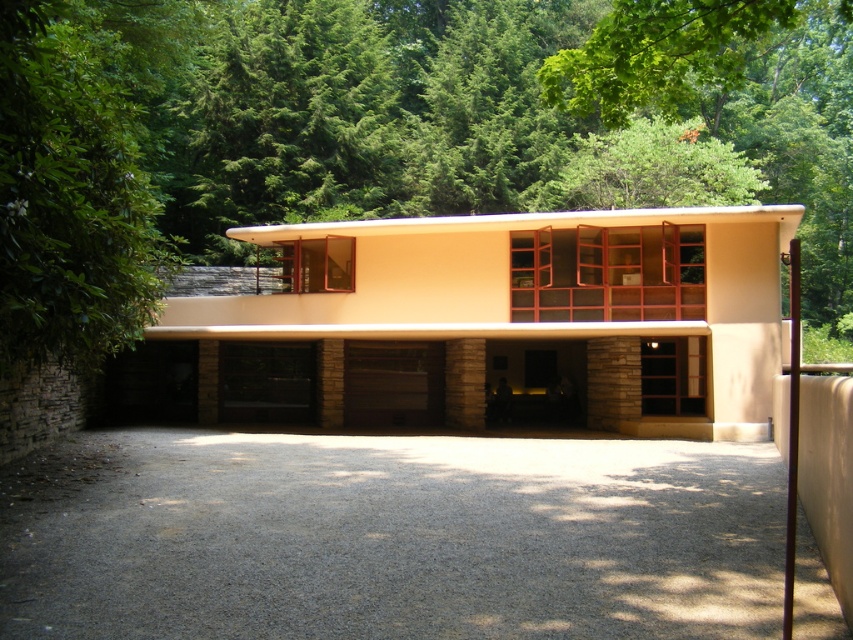
How distant is green leafy tree at upper center from gray gravel driveway at lower center?

green leafy tree at upper center and gray gravel driveway at lower center are 14.54 meters apart from each other.

Is point (643, 88) positioned before point (483, 627)?

No, (643, 88) is further to viewer.

Identify the location of green leafy tree at upper center. (373, 131).

Find the location of a particular element. Image resolution: width=853 pixels, height=640 pixels. gray gravel driveway at lower center is located at coordinates (389, 536).

Which of these two, gray gravel driveway at lower center or brown stone/glass garage door at center, stands taller?

With more height is brown stone/glass garage door at center.

What do you see at coordinates (389, 536) in the screenshot? I see `gray gravel driveway at lower center` at bounding box center [389, 536].

The height and width of the screenshot is (640, 853). Identify the location of gray gravel driveway at lower center. (389, 536).

In the scene shown: Is green leafy tree at upper center smaller than beige stone garage at center?

Actually, green leafy tree at upper center might be larger than beige stone garage at center.

Which is more to the left, green leafy tree at upper center or beige stone garage at center?

beige stone garage at center

Is point (115, 52) farther from camera compared to point (476, 280)?

No, (115, 52) is in front of (476, 280).

This screenshot has height=640, width=853. What are the coordinates of `green leafy tree at upper center` in the screenshot? It's located at (373, 131).